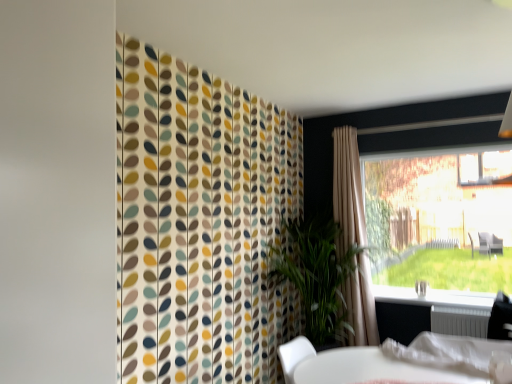
Question: Is white metallic radiator at lower right positioned behind white plastic bag at lower right?

Choices:
 (A) yes
 (B) no

Answer: (A)

Question: From the image's perspective, is white metallic radiator at lower right located above white plastic bag at lower right?

Choices:
 (A) yes
 (B) no

Answer: (B)

Question: Is white metallic radiator at lower right taller than white plastic bag at lower right?

Choices:
 (A) yes
 (B) no

Answer: (B)

Question: Can you confirm if white metallic radiator at lower right is smaller than white plastic bag at lower right?

Choices:
 (A) yes
 (B) no

Answer: (A)

Question: Is white metallic radiator at lower right next to white plastic bag at lower right?

Choices:
 (A) no
 (B) yes

Answer: (A)

Question: Is white plastic bag at lower right inside the boundaries of white metallic radiator at lower right, or outside?

Choices:
 (A) outside
 (B) inside

Answer: (A)

Question: From a real-world perspective, is white plastic bag at lower right above or below white metallic radiator at lower right?

Choices:
 (A) above
 (B) below

Answer: (A)

Question: In terms of size, does white plastic bag at lower right appear bigger or smaller than white metallic radiator at lower right?

Choices:
 (A) big
 (B) small

Answer: (A)

Question: Is white plastic bag at lower right taller or shorter than white metallic radiator at lower right?

Choices:
 (A) tall
 (B) short

Answer: (A)

Question: From a real-world perspective, is transparent glass window at right physically located above or below white plastic window sill at lower right?

Choices:
 (A) above
 (B) below

Answer: (A)

Question: Is point (380, 261) closer or farther from the camera than point (480, 301)?

Choices:
 (A) farther
 (B) closer

Answer: (A)

Question: From the image's perspective, is transparent glass window at right located above or below white plastic window sill at lower right?

Choices:
 (A) above
 (B) below

Answer: (A)

Question: Is transparent glass window at right to the left or to the right of white plastic window sill at lower right in the image?

Choices:
 (A) right
 (B) left

Answer: (A)

Question: From a real-world perspective, is beige fabric curtain at right physically located above or below transparent glass window at right?

Choices:
 (A) above
 (B) below

Answer: (B)

Question: Is beige fabric curtain at right wider or thinner than transparent glass window at right?

Choices:
 (A) wide
 (B) thin

Answer: (A)